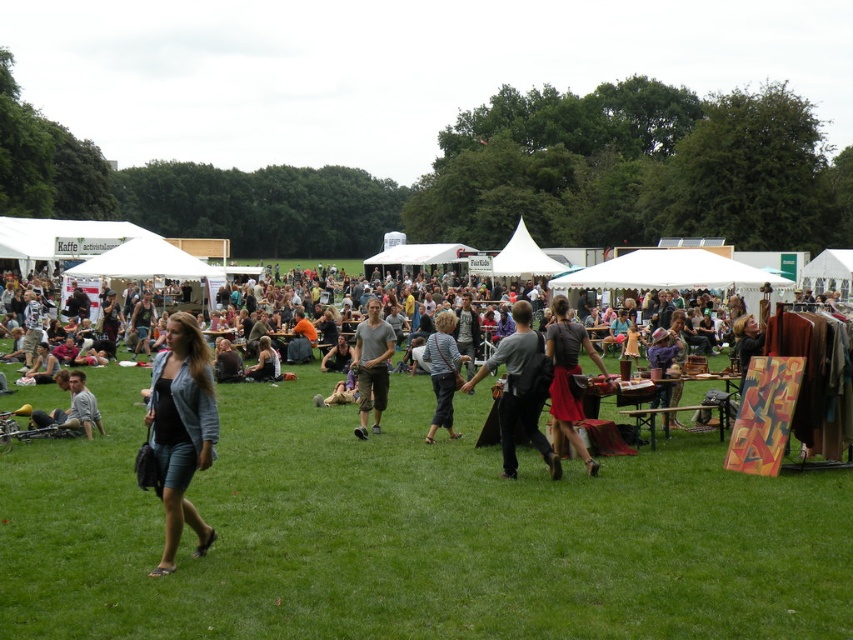
Question: Can you confirm if matte gray t-shirt at center is wider than striped shirt at center?

Choices:
 (A) yes
 (B) no

Answer: (A)

Question: Among these objects, which one is nearest to the camera?

Choices:
 (A) denim jacket at center
 (B) denim shorts at center
 (C) light brown leather jacket at lower left

Answer: (B)

Question: Considering the real-world distances, which object is farthest from the light brown leather jacket at lower left?

Choices:
 (A) denim jacket at center
 (B) matte gray t-shirt at center
 (C) matte black dress at center

Answer: (A)

Question: Which of the following is the closest to the observer?

Choices:
 (A) matte gray t-shirt at center
 (B) matte black dress at center
 (C) light brown leather jacket at lower left
 (D) denim shorts at center

Answer: (D)

Question: Does denim shorts at center have a lesser width compared to dark gray backpack at center?

Choices:
 (A) no
 (B) yes

Answer: (A)

Question: Does denim jacket at center have a smaller size compared to matte black dress at center?

Choices:
 (A) yes
 (B) no

Answer: (B)